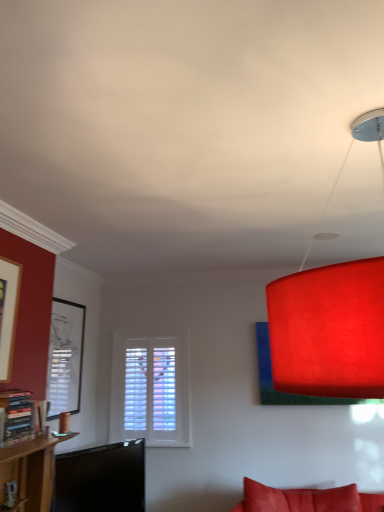
Question: Does point (332, 393) appear closer or farther from the camera than point (49, 358)?

Choices:
 (A) closer
 (B) farther

Answer: (A)

Question: Which is correct: matte red lampshade at upper right is inside matte black picture frame at left, or outside of it?

Choices:
 (A) outside
 (B) inside

Answer: (A)

Question: Estimate the real-world distances between objects in this image. Which object is closer to the wooden bookshelf at left?

Choices:
 (A) matte red lampshade at upper right
 (B) matte black picture frame at left

Answer: (B)

Question: Which of these objects is positioned closest to the wooden bookshelf at left?

Choices:
 (A) matte red lampshade at upper right
 (B) matte black picture frame at left

Answer: (B)